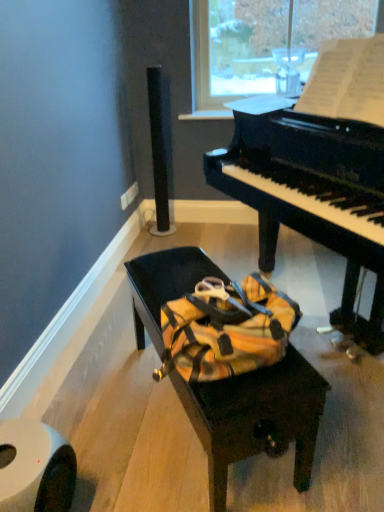
Question: Does white matte toilet paper at lower left have a larger size compared to matte black bench at center?

Choices:
 (A) yes
 (B) no

Answer: (B)

Question: From a real-world perspective, is white matte toilet paper at lower left under matte black bench at center?

Choices:
 (A) yes
 (B) no

Answer: (A)

Question: From the image's perspective, does white matte toilet paper at lower left appear higher than matte black bench at center?

Choices:
 (A) yes
 (B) no

Answer: (B)

Question: Is white matte toilet paper at lower left positioned far away from matte black bench at center?

Choices:
 (A) yes
 (B) no

Answer: (B)

Question: Is white matte toilet paper at lower left aimed at matte black bench at center?

Choices:
 (A) yes
 (B) no

Answer: (B)

Question: Considering the positions of black glossy piano at center and matte black bench at center in the image, is black glossy piano at center bigger or smaller than matte black bench at center?

Choices:
 (A) small
 (B) big

Answer: (B)

Question: Is point (354, 141) closer or farther from the camera than point (243, 406)?

Choices:
 (A) farther
 (B) closer

Answer: (A)

Question: Looking at their shapes, would you say black glossy piano at center is wider or thinner than matte black bench at center?

Choices:
 (A) thin
 (B) wide

Answer: (B)

Question: Relative to matte black bench at center, is black glossy piano at center in front or behind?

Choices:
 (A) behind
 (B) front

Answer: (B)

Question: In the image, is black glossy piano at center positioned in front of or behind white matte toilet paper at lower left?

Choices:
 (A) front
 (B) behind

Answer: (A)

Question: Considering the positions of black glossy piano at center and white matte toilet paper at lower left in the image, is black glossy piano at center taller or shorter than white matte toilet paper at lower left?

Choices:
 (A) tall
 (B) short

Answer: (A)

Question: Would you say black glossy piano at center is to the left or to the right of white matte toilet paper at lower left in the picture?

Choices:
 (A) right
 (B) left

Answer: (A)

Question: From the image's perspective, relative to white matte toilet paper at lower left, is black glossy piano at center above or below?

Choices:
 (A) above
 (B) below

Answer: (A)

Question: Based on their positions, is white matte toilet paper at lower left located to the left or right of matte black bench at center?

Choices:
 (A) right
 (B) left

Answer: (B)

Question: From a real-world perspective, is white matte toilet paper at lower left physically located above or below matte black bench at center?

Choices:
 (A) below
 (B) above

Answer: (A)